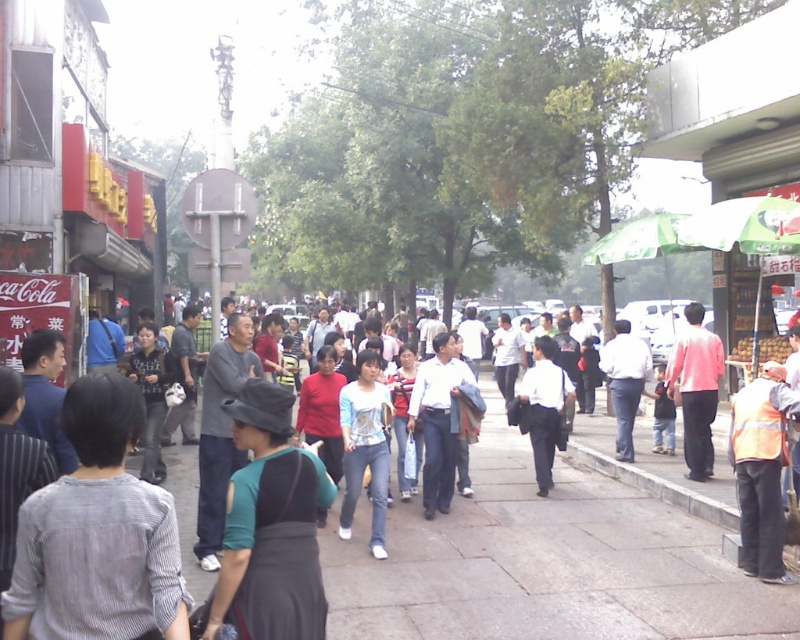
Question: Is white cotton shirt at center positioned before light blue denim jeans at center?

Choices:
 (A) no
 (B) yes

Answer: (A)

Question: Which is farther from the white shirt at center?

Choices:
 (A) white cotton shirt at center
 (B) pink matte shirt at center

Answer: (A)

Question: Observing the image, what is the correct spatial positioning of light blue denim jeans at center in reference to white smooth shirt at center?

Choices:
 (A) below
 (B) above

Answer: (A)

Question: Where is teal fabric shirt at center located in relation to white cotton shirt at center in the image?

Choices:
 (A) above
 (B) below

Answer: (A)

Question: Which point is closer to the camera?

Choices:
 (A) teal fabric shirt at center
 (B) gray concrete pavement at center

Answer: (A)

Question: Which of these objects is positioned closest to the teal fabric shirt at center?

Choices:
 (A) striped fabric shirt at center
 (B) gray concrete pavement at center
 (C) pink matte shirt at center
 (D) white shirt at center

Answer: (A)